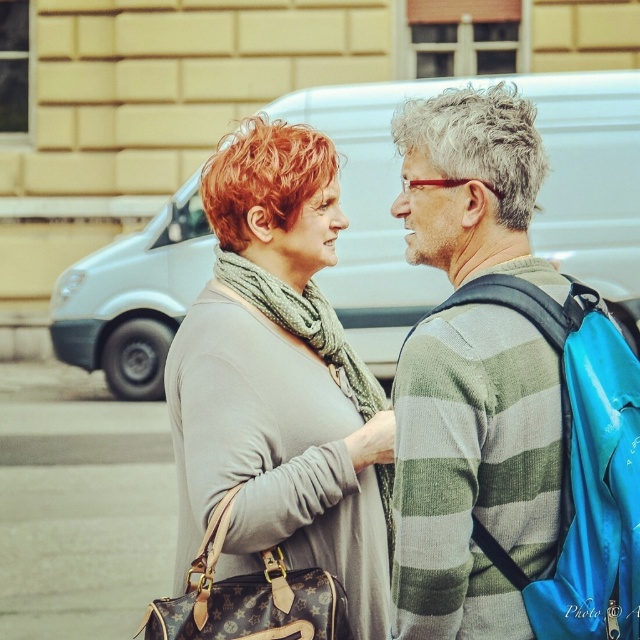
Between striped sweater at center and matte gray scarf at center, which one is positioned lower?

matte gray scarf at center is below.

Does striped sweater at center have a lesser width compared to matte gray scarf at center?

Correct, striped sweater at center's width is less than matte gray scarf at center's.

Between point (492, 518) and point (275, 332), which one is positioned behind?

Point (275, 332)

Locate an element on the screen. The height and width of the screenshot is (640, 640). striped sweater at center is located at coordinates (472, 468).